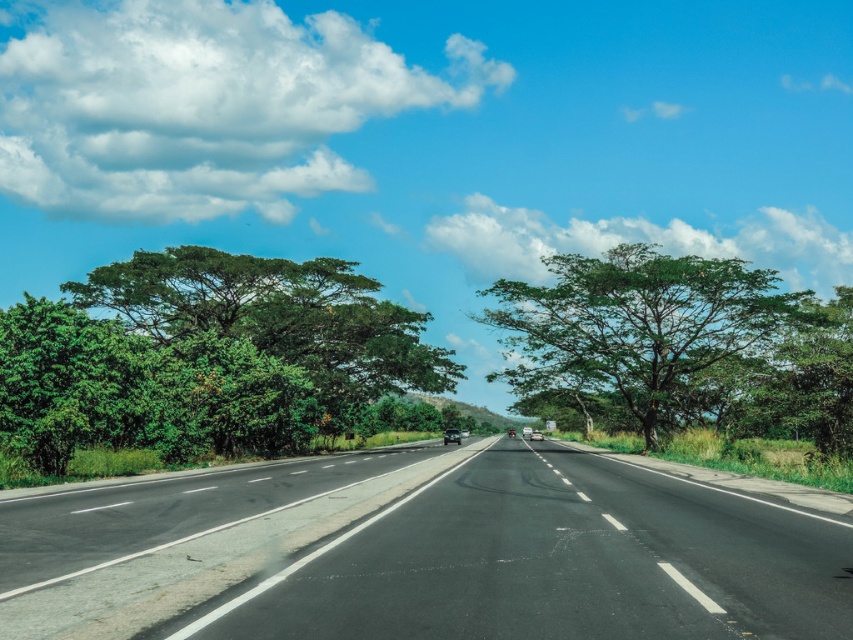
You are driving a car that is 4.5 meters long. You see the black asphalt highway at center and the green leafy tree at left in your view. Can your car fit entirely between them without touching either?

The distance between the black asphalt highway at center and the green leafy tree at left is 18.94 meters. Since your car is only 4.5 meters long, it can easily fit entirely between them without touching either.

You are driving a car and need to determine the best path to avoid obstacles. Given the black asphalt highway at center and the green leafy tree at center, which one takes up more space in the image?

The green leafy tree at center occupies more space than the black asphalt highway at center according to the description.